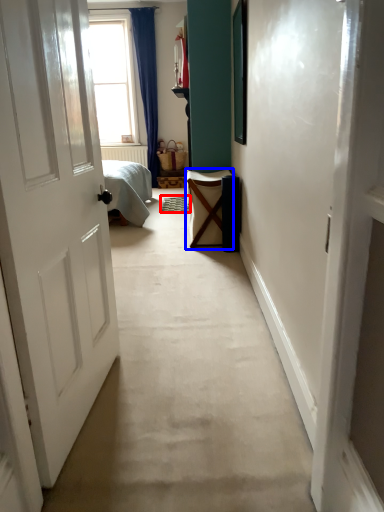
Question: Which object appears closest to the camera in this image, doormat (highlighted by a red box) or furniture (highlighted by a blue box)?

Choices:
 (A) doormat
 (B) furniture

Answer: (B)